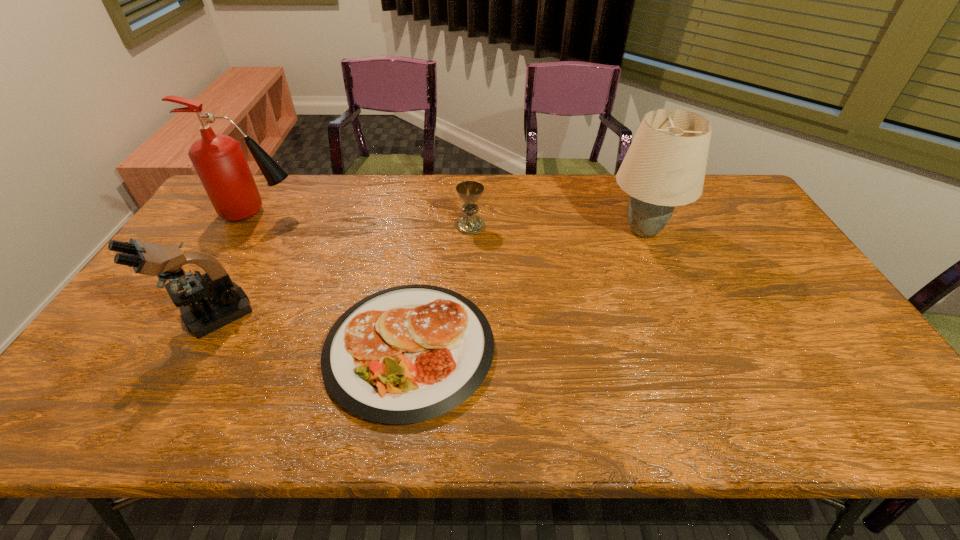
Locate an element on the screen. Image resolution: width=960 pixels, height=540 pixels. vacant area between the shortest object and the microscope is located at coordinates (311, 332).

The width and height of the screenshot is (960, 540). What are the coordinates of `unoccupied area between the fire extinguisher and the chalice` in the screenshot? It's located at (365, 219).

Identify the location of free space between the third shortest object and the shortest object. The height and width of the screenshot is (540, 960). (311, 332).

Locate an element on the screen. The image size is (960, 540). unoccupied area between the dish and the third tallest object is located at coordinates (311, 332).

Find the location of a particular element. vacant area that lies between the fire extinguisher and the third tallest object is located at coordinates (236, 264).

Find the location of a particular element. Image resolution: width=960 pixels, height=540 pixels. free space between the lampshade and the microscope is located at coordinates (428, 273).

I want to click on vacant point located between the fire extinguisher and the chalice, so click(365, 219).

Locate an element on the screen. The width and height of the screenshot is (960, 540). vacant space that is in between the chalice and the microscope is located at coordinates (342, 271).

Locate an element on the screen. The image size is (960, 540). object that stands as the second closest to the third shortest object is located at coordinates (219, 161).

This screenshot has height=540, width=960. I want to click on the second closest object to the third shortest object, so click(219, 161).